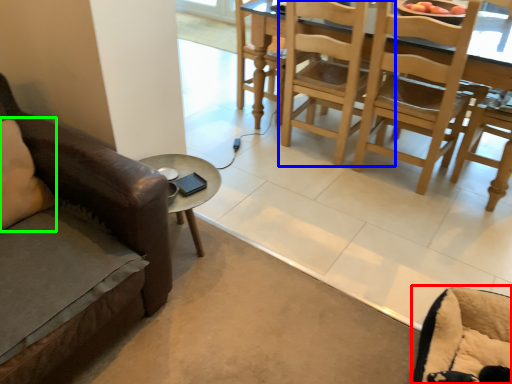
Question: Considering the real-world distances, which object is closest to swivel chair (highlighted by a red box)? chair (highlighted by a blue box) or pillow (highlighted by a green box).

Choices:
 (A) chair
 (B) pillow

Answer: (A)